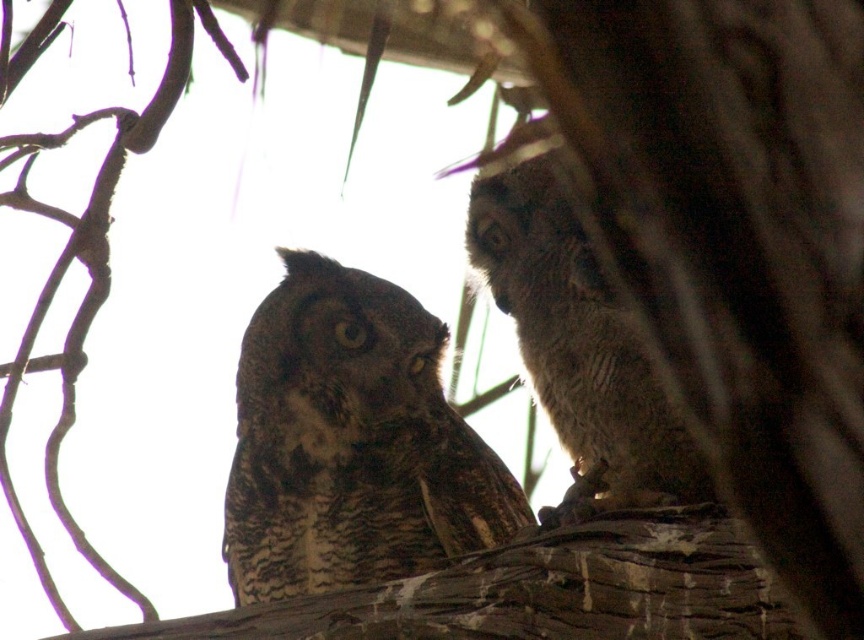
Who is positioned more to the left, brown speckled owl at center or speckled brown owl at right?

From the viewer's perspective, brown speckled owl at center appears more on the left side.

Between point (234, 476) and point (648, 499), which one is positioned behind?

Point (234, 476)

Locate an element on the screen. The width and height of the screenshot is (864, 640). brown speckled owl at center is located at coordinates (351, 442).